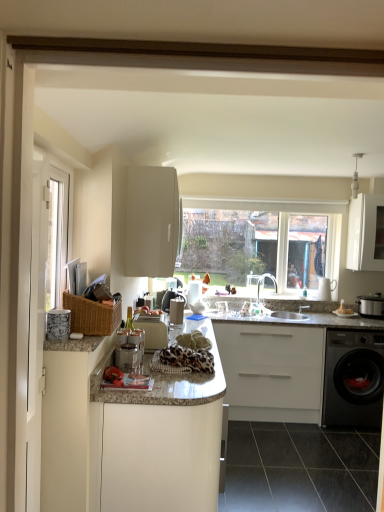
Question: From a real-world perspective, is white glossy screen door at left positioned above or below matte white bowl at right?

Choices:
 (A) above
 (B) below

Answer: (A)

Question: Looking at their shapes, would you say white glossy screen door at left is wider or thinner than matte white bowl at right?

Choices:
 (A) wide
 (B) thin

Answer: (B)

Question: Estimate the real-world distances between objects in this image. Which object is farther from the black glossy washing machine at lower right?

Choices:
 (A) porcelain textured mug at left, which is the 1th appliance in front-to-back order
 (B) white painted wood window frame at left
 (C) matte white bowl at right
 (D) white matte cabinet at center, placed as the 3th cabinetry when sorted from left to right
 (E) metallic silver slow cooker at right, the 1th appliance viewed from the right

Answer: (B)

Question: Based on their relative distances, which object is farther from the white matte cabinet at upper center, arranged as the 4th cabinetry when viewed from the right?

Choices:
 (A) matte white bowl at right
 (B) white painted wood window frame at left
 (C) white glossy screen door at left
 (D) white glossy countertop at center, arranged as the third cabinetry when viewed from the right
 (E) white matte cabinet at center, placed as the 3th cabinetry when sorted from left to right

Answer: (A)